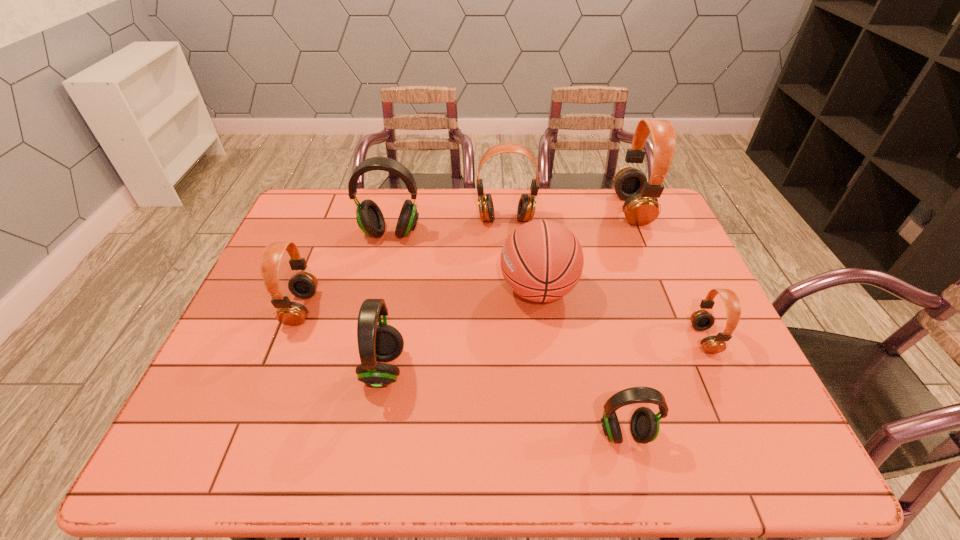
This screenshot has height=540, width=960. I want to click on empty location between the smallest brown headset and the tallest object, so click(668, 274).

The image size is (960, 540). I want to click on unoccupied position between the second farthest black headset and the third smallest brown headset, so click(444, 294).

Identify the location of free space between the basketball and the second biggest black headset. (461, 329).

The width and height of the screenshot is (960, 540). What are the coordinates of `free point between the biggest black headset and the leftmost object` in the screenshot? It's located at (346, 271).

Identify the location of object that is the seventh closest to the tallest headset. (303, 284).

Choose which object is the third nearest neighbor to the tallest headset. Please provide its 2D coordinates. Your answer should be formatted as a tuple, i.e. [(x, y)], where the tuple contains the x and y coordinates of a point satisfying the conditions above.

[(701, 320)]

Find the location of a particular element. Image resolution: width=960 pixels, height=540 pixels. headset that is the second closest one to the tallest object is located at coordinates click(701, 320).

Identify which headset is the closest to the second smallest black headset. Please provide its 2D coordinates. Your answer should be formatted as a tuple, i.e. [(x, y)], where the tuple contains the x and y coordinates of a point satisfying the conditions above.

[(303, 284)]

Identify which brown headset is the second closest to the farthest black headset. Please provide its 2D coordinates. Your answer should be formatted as a tuple, i.e. [(x, y)], where the tuple contains the x and y coordinates of a point satisfying the conditions above.

[(303, 284)]

Select which brown headset appears as the fourth closest to the rightmost black headset. Please provide its 2D coordinates. Your answer should be formatted as a tuple, i.e. [(x, y)], where the tuple contains the x and y coordinates of a point satisfying the conditions above.

[(303, 284)]